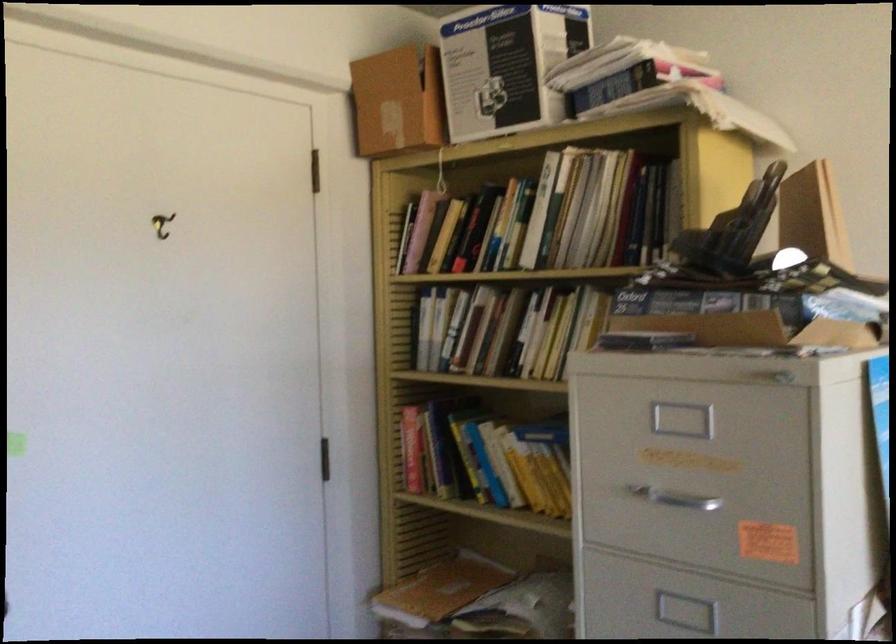
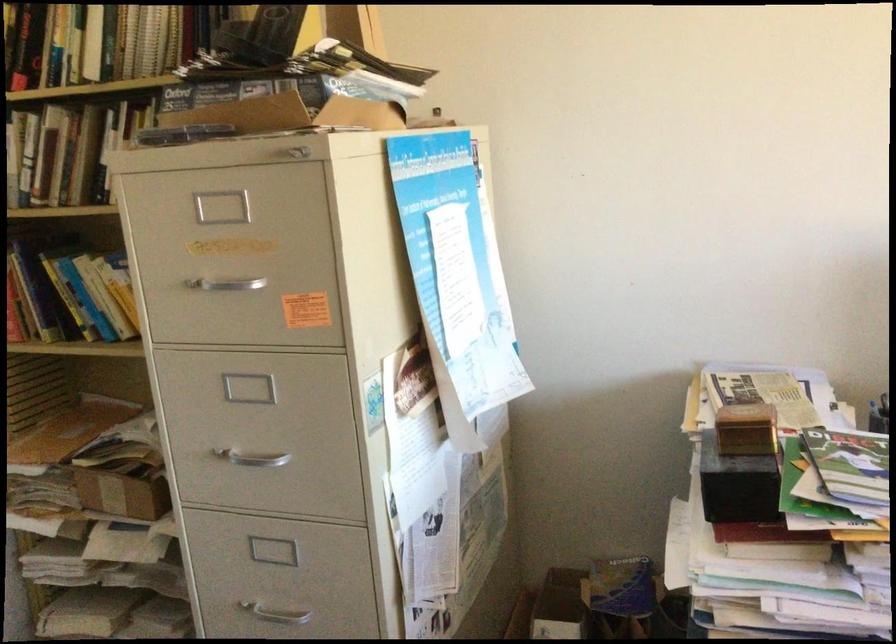
What movement of the cameraman would produce the second image?

The cameraman moved toward right, backward.